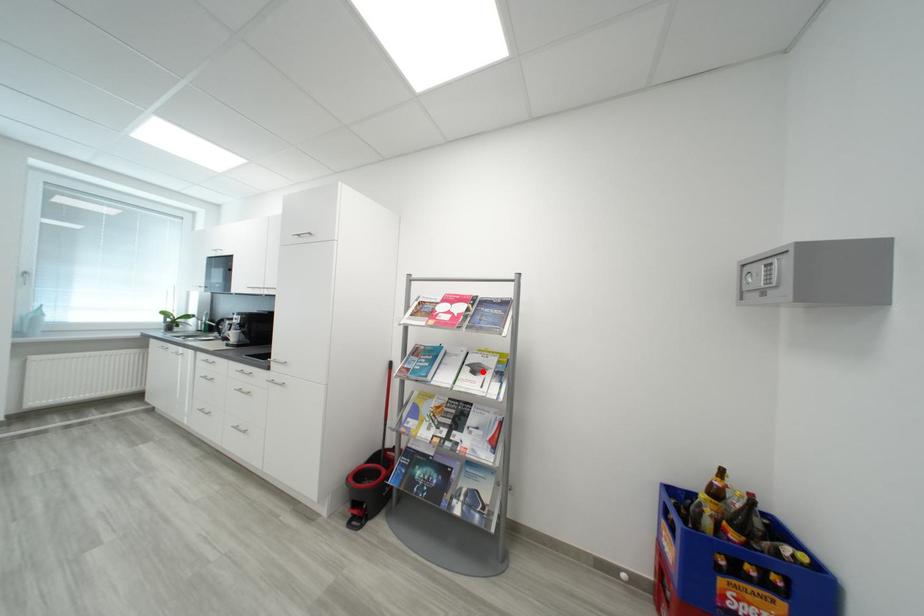
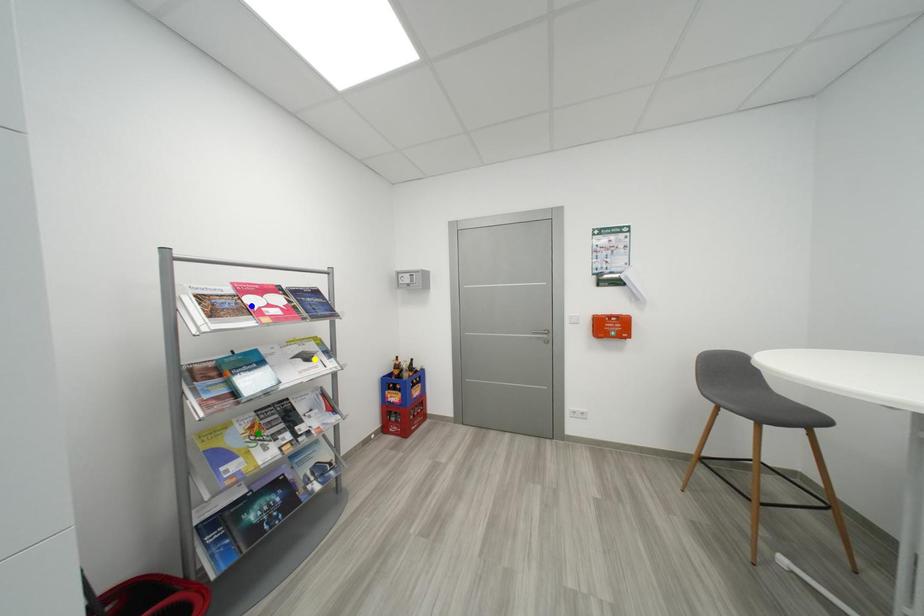
Question: I am providing you with two images of the same scene from different viewpoints. A red point is marked on the first image. You are given multiple points on the second image. Which mark in image 2 goes with the point in image 1?

Choices:
 (A) green point
 (B) yellow point
 (C) blue point

Answer: (B)